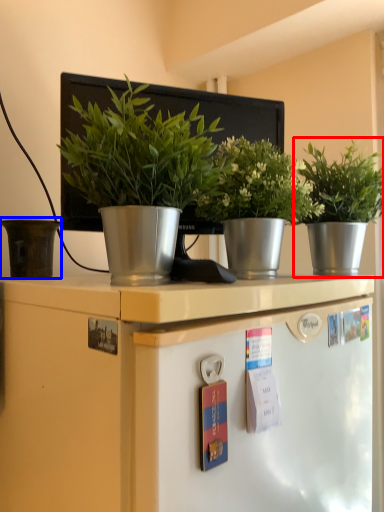
Question: Which point is further to the camera, houseplant (highlighted by a red box) or flowerpot (highlighted by a blue box)?

Choices:
 (A) houseplant
 (B) flowerpot

Answer: (B)